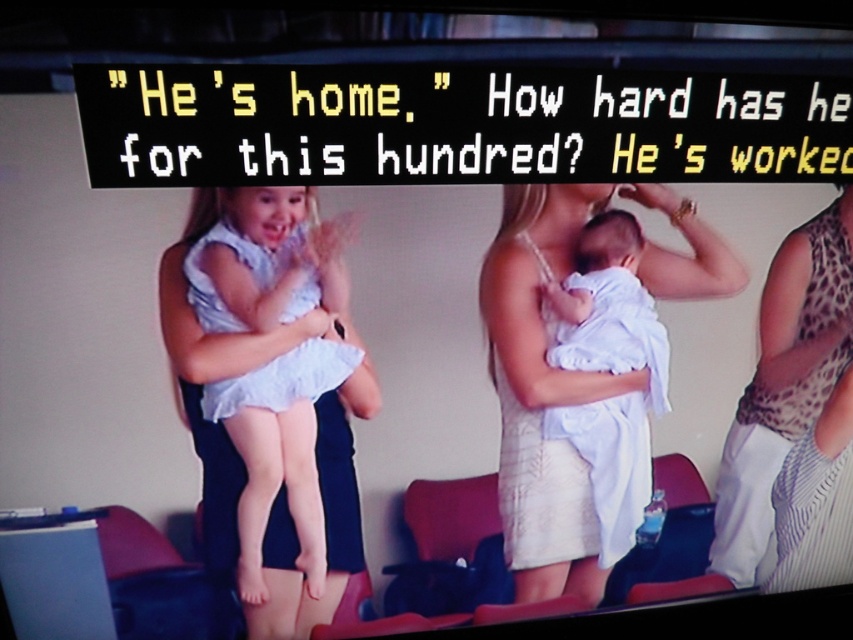
Can you confirm if white lace dress at center is positioned to the right of white clothed baby at center?

No, white lace dress at center is not to the right of white clothed baby at center.

Which is more to the right, white lace dress at center or white clothed baby at center?

Positioned to the right is white clothed baby at center.

The height and width of the screenshot is (640, 853). Identify the location of white lace dress at center. (567, 371).

Who is positioned more to the left, leopard print dress at right or white clothed baby at center?

From the viewer's perspective, white clothed baby at center appears more on the left side.

How much distance is there between leopard print dress at right and white clothed baby at center?

leopard print dress at right and white clothed baby at center are 8.43 inches apart.

Does point (799, 333) come behind point (622, 301)?

Yes, it is.

Locate an element on the screen. Image resolution: width=853 pixels, height=640 pixels. leopard print dress at right is located at coordinates (784, 381).

Is white lace dress at center to the left of light blue fabric dress at center from the viewer's perspective?

No, white lace dress at center is not to the left of light blue fabric dress at center.

Does white lace dress at center have a lesser width compared to light blue fabric dress at center?

Incorrect, white lace dress at center's width is not less than light blue fabric dress at center's.

Does point (714, 275) lie in front of point (254, 337)?

No, (714, 275) is behind (254, 337).

This screenshot has width=853, height=640. In order to click on white lace dress at center in this screenshot , I will do `click(567, 371)`.